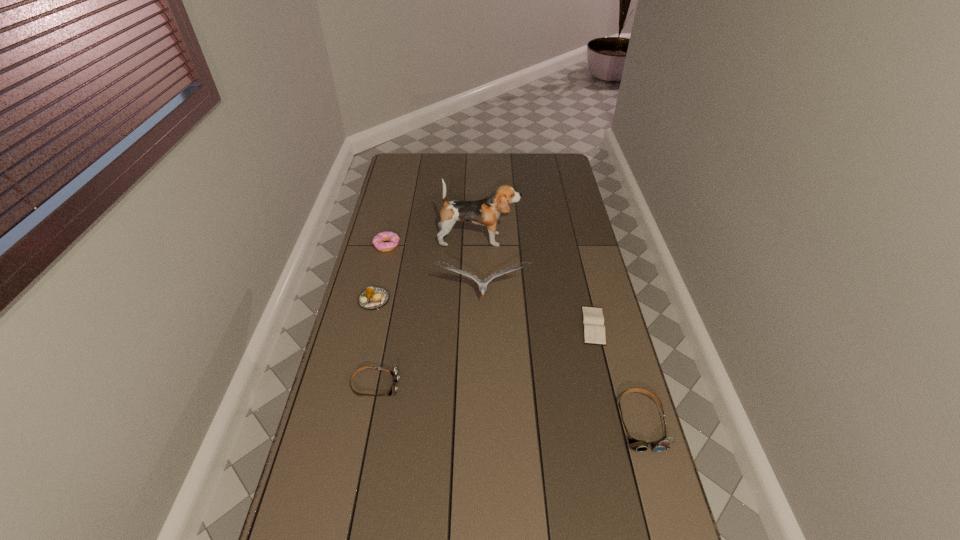
Where is `vacant space at the far edge`? The image size is (960, 540). vacant space at the far edge is located at coordinates (457, 167).

This screenshot has width=960, height=540. Identify the location of vacant region at the near edge of the desktop. (491, 506).

Where is `free space at the left edge of the desktop`? The image size is (960, 540). free space at the left edge of the desktop is located at coordinates (358, 305).

Where is `vacant area at the right edge`? vacant area at the right edge is located at coordinates (571, 306).

Locate an element on the screen. This screenshot has width=960, height=540. free location at the near left corner is located at coordinates (297, 528).

What are the coordinates of `free point between the left goggles and the shortest object` in the screenshot? It's located at (485, 355).

The image size is (960, 540). What are the coordinates of `empty space between the shorter goggles and the doughnut` in the screenshot? It's located at (381, 315).

Identify the location of vacant space that's between the left goggles and the shortest object. The height and width of the screenshot is (540, 960). click(485, 355).

The height and width of the screenshot is (540, 960). I want to click on vacant point located between the shorter goggles and the doughnut, so click(381, 315).

The image size is (960, 540). I want to click on empty space between the shorter goggles and the tallest object, so click(427, 312).